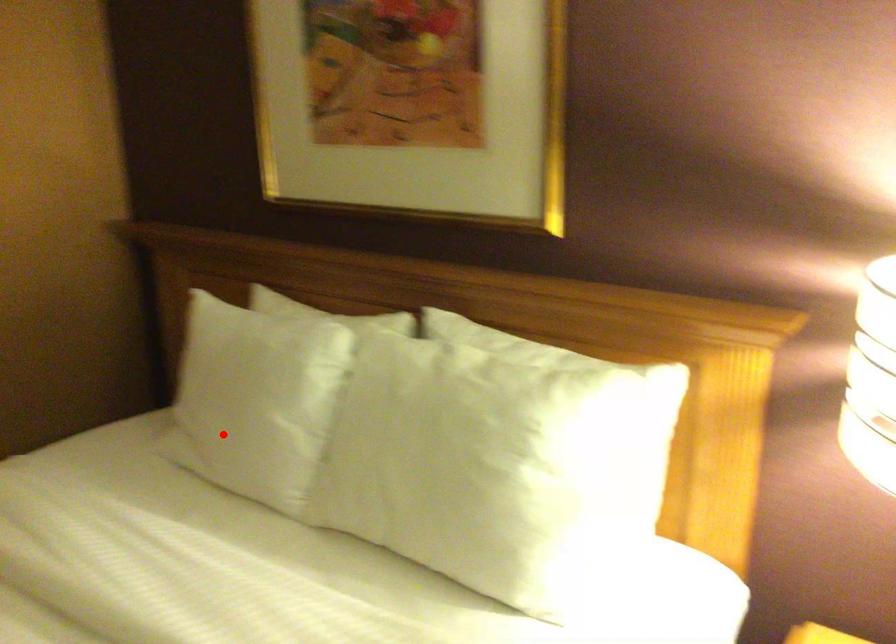
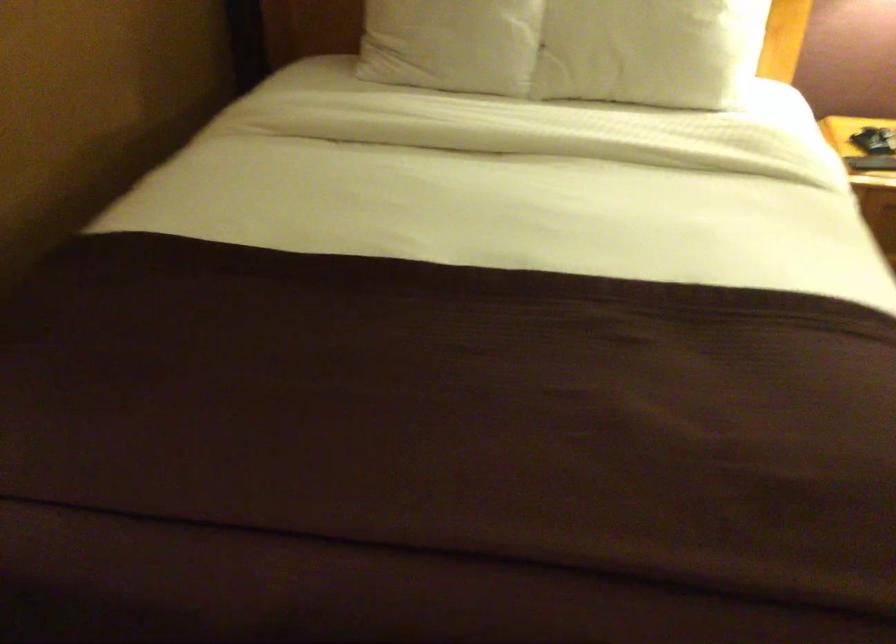
Where in the second image is the point corresponding to the highlighted location from the first image?

(452, 44)